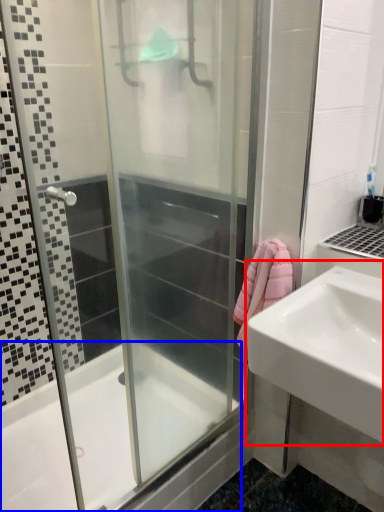
Question: Among these objects, which one is nearest to the camera, sink (highlighted by a red box) or bathtub (highlighted by a blue box)?

Choices:
 (A) sink
 (B) bathtub

Answer: (A)